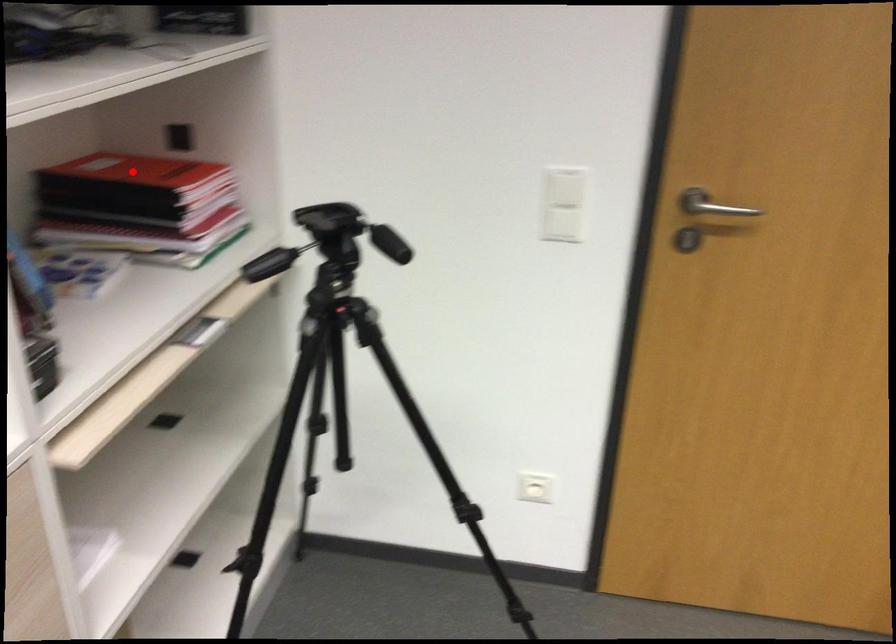
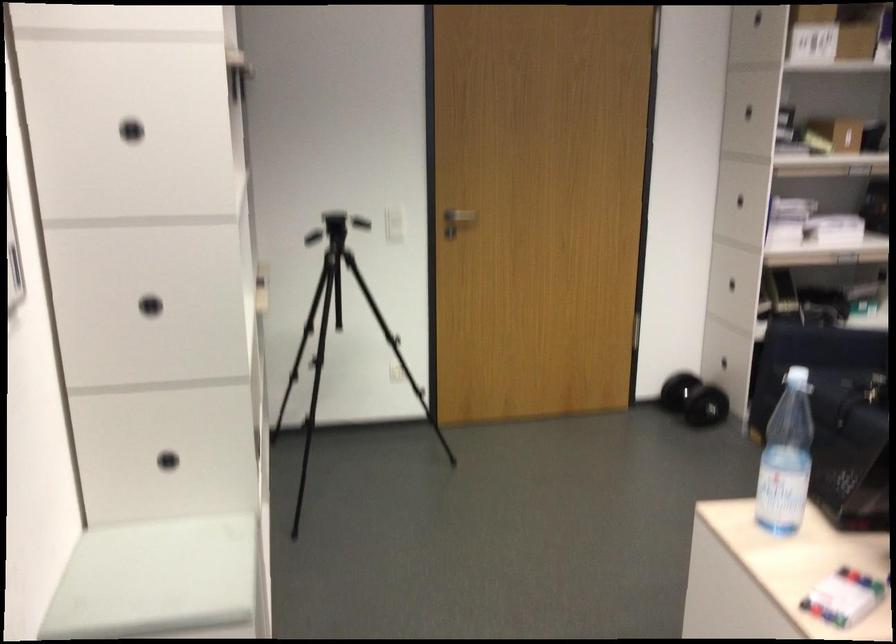
Question: I am providing you with two images of the same scene from different viewpoints. A red point is marked on the first image. Can you still see the location of the red point in image 2?

Choices:
 (A) Yes
 (B) No

Answer: (B)